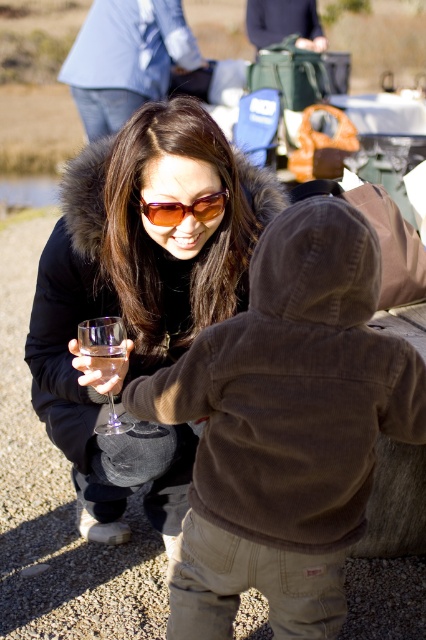
You are a photographer trying to capture a closeup shot of the matte black jacket at center and the sunglasses at center. Since you want to focus on both objects equally, which one should you zoom in on more to ensure they appear the same size in the photo?

The matte black jacket at center is larger in size than sunglasses at center, so you should zoom in more on the sunglasses at center to make them appear the same size as the jacket in the photo.

You are standing in the outdoor scene and want to walk from the point at coordinates point (108,378) to the point at coordinates point (115,360). Which direction should you face to move towards the second point?

Point (108,378) is further to the viewer than point (115,360). To move towards the second point, you should face away from your current position, which would be towards the background of the scene.